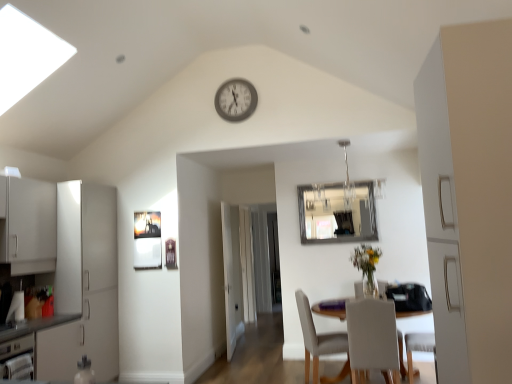
You are a GUI agent. You are given a task and a screenshot of the screen. Output one action in this format:
    pyautogui.click(x=<x>, y=<y>)
    Task: Click on the empty space that is ontop of metallic gray clock at upper center (from a real-world perspective)
    
    Given the screenshot: What is the action you would take?
    pyautogui.click(x=233, y=71)